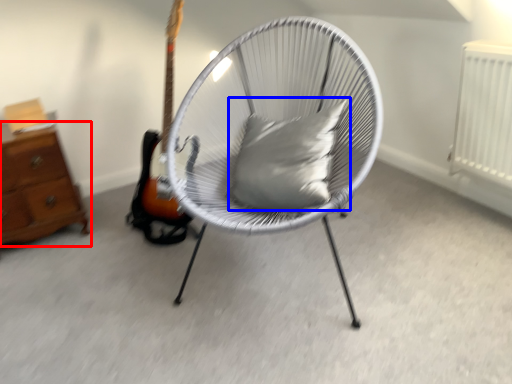
Question: Among these objects, which one is nearest to the camera, chest of drawers (highlighted by a red box) or pillow (highlighted by a blue box)?

Choices:
 (A) chest of drawers
 (B) pillow

Answer: (B)